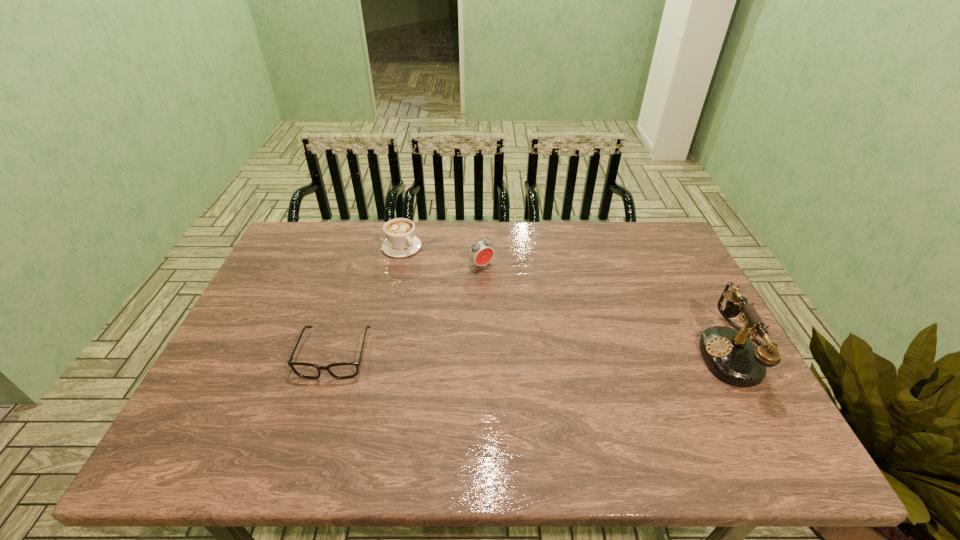
The image size is (960, 540). Identify the location of vacant space situated on the face of the second tallest object. (512, 296).

At what (x,y) coordinates should I click in order to perform the action: click on vacant area located 0.240m on the face of the second tallest object. Please return your answer as a coordinate pair (x, y). This screenshot has width=960, height=540. Looking at the image, I should click on (535, 320).

Image resolution: width=960 pixels, height=540 pixels. What are the coordinates of `free point located on the face of the second tallest object` in the screenshot? It's located at coord(539,325).

Locate an element on the screen. Image resolution: width=960 pixels, height=540 pixels. vacant space positioned to the right of the cappuccino's handle is located at coordinates (482, 310).

Find the location of a particular element. This screenshot has height=540, width=960. free point located to the right of the cappuccino's handle is located at coordinates (448, 284).

At what (x,y) coordinates should I click in order to perform the action: click on free spot located to the right of the cappuccino's handle. Please return your answer as a coordinate pair (x, y). This screenshot has width=960, height=540. Looking at the image, I should click on (434, 272).

Locate an element on the screen. Image resolution: width=960 pixels, height=540 pixels. alarm clock located in the far edge section of the desktop is located at coordinates (480, 253).

Find the location of a particular element. This screenshot has height=540, width=960. cappuccino at the far edge is located at coordinates (401, 242).

Locate an element on the screen. object at the near edge is located at coordinates [730, 354].

Locate an element on the screen. This screenshot has width=960, height=540. object that is positioned at the right edge is located at coordinates (730, 354).